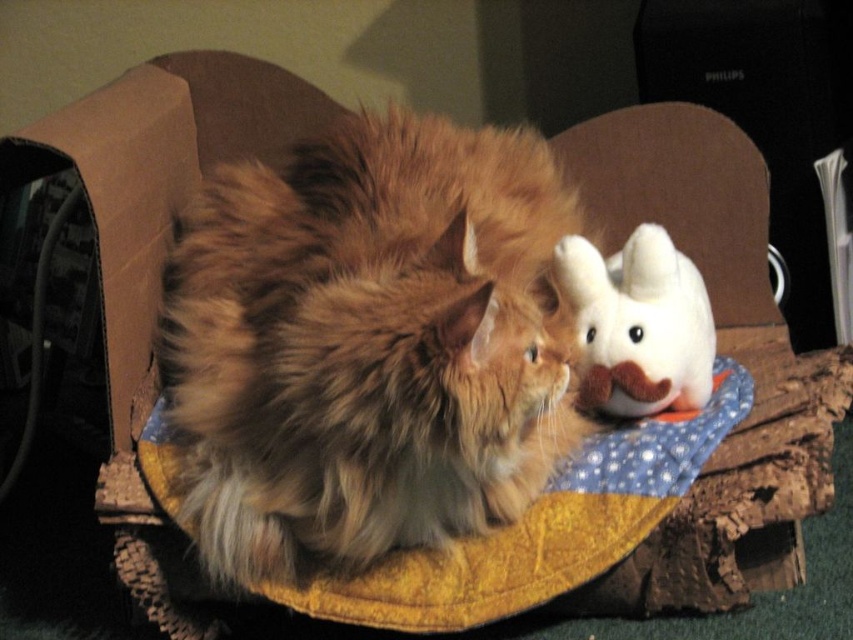
You are a pet sitter who needs to place a small bowl of water for the fuzzy brown cat at center. The bowl is 3 inches in diameter. Where should you place the bowl so it is within reach of the cat but not too close to the white plush toy at upper right?

Place the bowl between the fuzzy brown cat at center and the white plush toy at upper right, at least 3 inches away from the cat to ensure it is within reach but not too close to the toy.

You are a photographer trying to capture a closeup of the white plush toy at upper right without the fuzzy brown cat at center blocking it. What should you do?

Move the camera position so that the white plush toy at upper right is no longer behind the fuzzy brown cat at center. Since the fuzzy brown cat at center is in front of the white plush toy at upper right, adjusting the angle or moving around the cat will allow you to take the photo without obstruction.

Based on the scene description, what are the coordinates of the fuzzy brown cat at center?

The coordinates of the fuzzy brown cat at center are at point (367, 344).